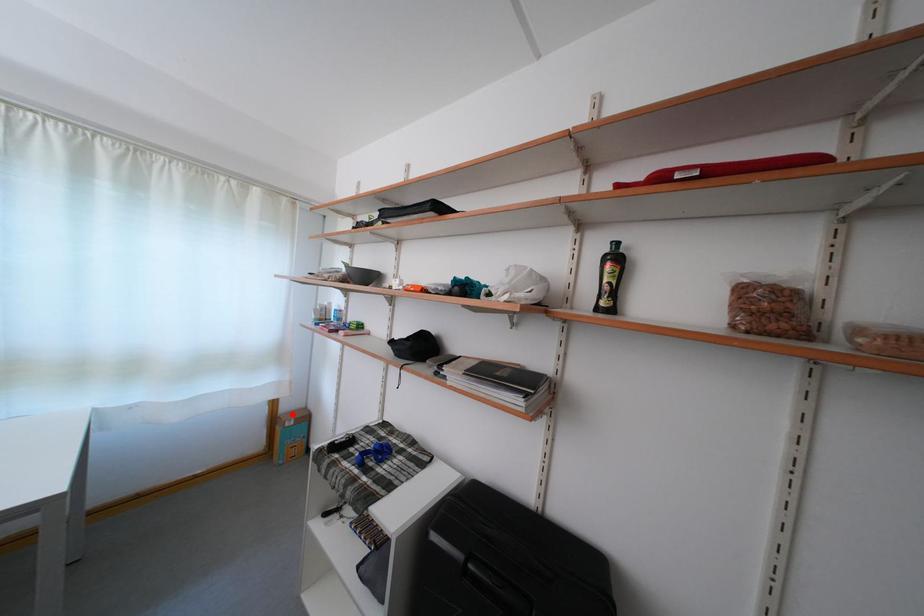
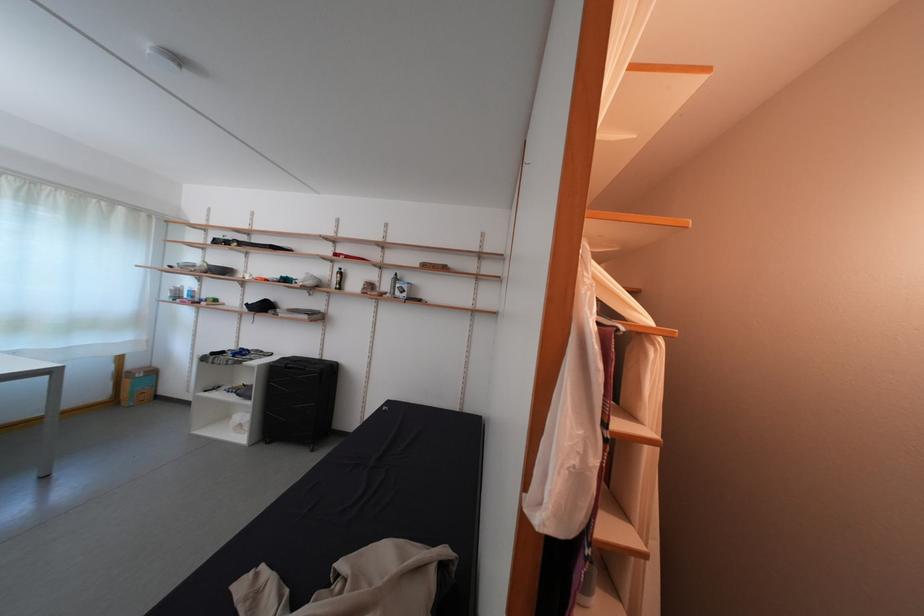
Question: I am providing you with two images of the same scene from different viewpoints. A red point is marked on the first image. Can you still see the location of the red point in image 2?

Choices:
 (A) Yes
 (B) No

Answer: (A)